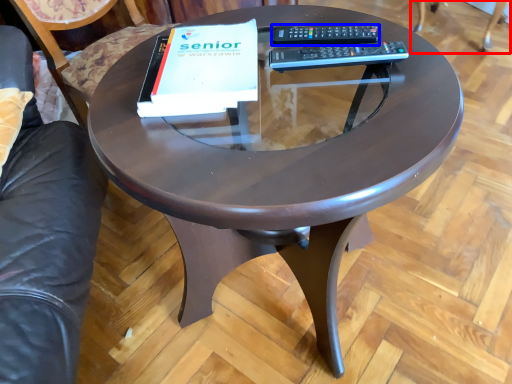
Question: Which point is closer to the camera, swivel chair (highlighted by a red box) or remote (highlighted by a blue box)?

Choices:
 (A) swivel chair
 (B) remote

Answer: (B)